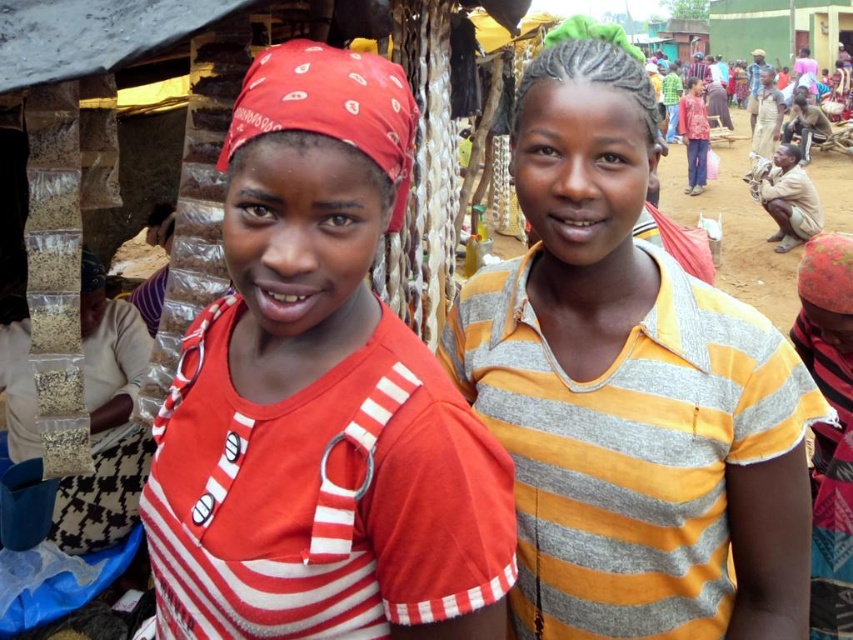
Who is lower down, matte red bandana at left or yellow striped shirt at center?

matte red bandana at left

Between point (212, 307) and point (660, 515), which one is positioned in front?

Point (660, 515) is in front.

The height and width of the screenshot is (640, 853). I want to click on matte red bandana at left, so click(320, 396).